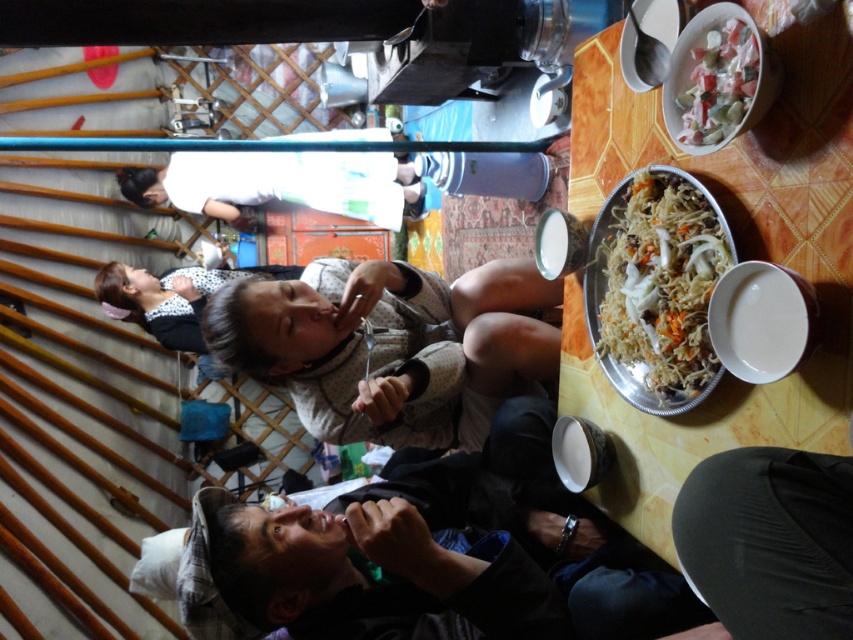
Between white rice pilaf at upper right and shiny plastic bowl at upper right, which one has less height?

Standing shorter between the two is shiny plastic bowl at upper right.

Who is more forward, (595, 346) or (712, 60)?

Point (712, 60) is in front.

Is point (608, 243) farther from camera compared to point (717, 48)?

Yes, it is.

Locate an element on the screen. Image resolution: width=853 pixels, height=640 pixels. white rice pilaf at upper right is located at coordinates (656, 289).

Which is more to the right, wooden table at right or white rice pilaf at upper right?

Result: From the viewer's perspective, white rice pilaf at upper right appears more on the right side.

Between wooden table at right and white rice pilaf at upper right, which one has more height?

wooden table at right is taller.

I want to click on wooden table at right, so click(x=738, y=259).

Can you confirm if wooden table at right is thinner than shiny plastic bowl at upper right?

No, wooden table at right is not thinner than shiny plastic bowl at upper right.

Is point (763, 164) closer to viewer compared to point (723, 36)?

No, (763, 164) is further to viewer.

Where is `wooden table at right`? The width and height of the screenshot is (853, 640). wooden table at right is located at coordinates (738, 259).

What are the coordinates of `wooden table at right` in the screenshot? It's located at (738, 259).